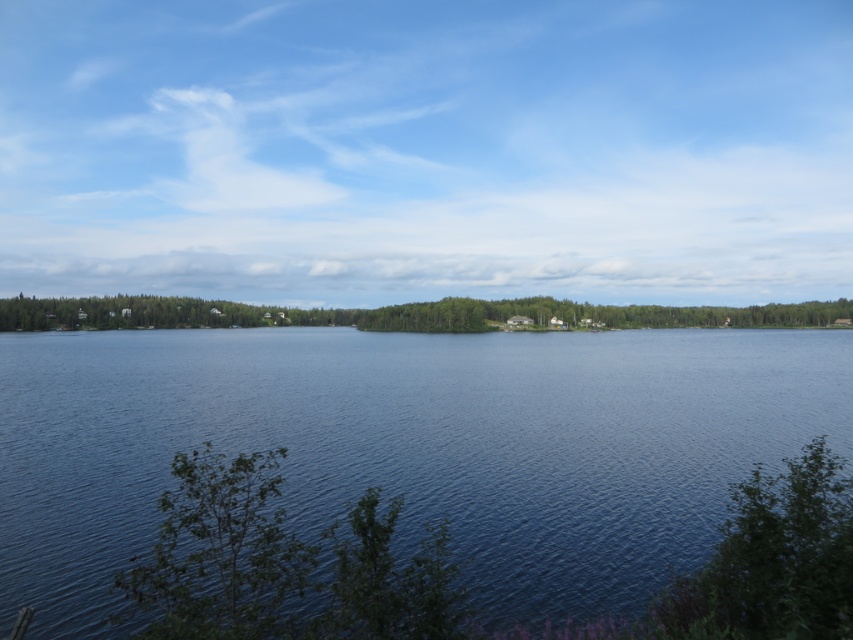
Looking at this image, is green leafy bush at lower right shorter than green leafy trees at center?

Correct, green leafy bush at lower right is not as tall as green leafy trees at center.

Measure the distance from green leafy bush at lower right to green leafy trees at center.

green leafy bush at lower right is 793.47 feet away from green leafy trees at center.

Is point (769, 568) positioned after point (256, 308)?

No.

Where is `green leafy bush at lower right`? green leafy bush at lower right is located at coordinates (772, 561).

Does point (821, 397) lie in front of point (259, 308)?

Yes, it is.

Between blue water at center and green leafy trees at center, which one has more height?

Standing taller between the two is green leafy trees at center.

Locate an element on the screen. blue water at center is located at coordinates (409, 449).

Describe the element at coordinates (409, 449) in the screenshot. I see `blue water at center` at that location.

Who is more distant from viewer, (x=793, y=454) or (x=251, y=490)?

The point (x=793, y=454) is more distant.

Who is more forward, (x=129, y=540) or (x=254, y=598)?

Point (x=254, y=598) is in front.

Where is `blue water at center`? Image resolution: width=853 pixels, height=640 pixels. blue water at center is located at coordinates (409, 449).